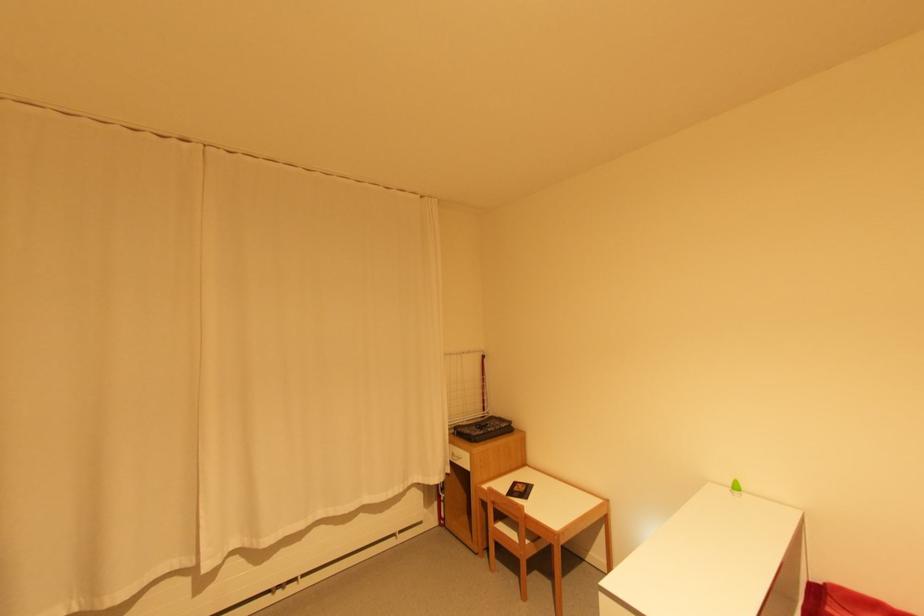
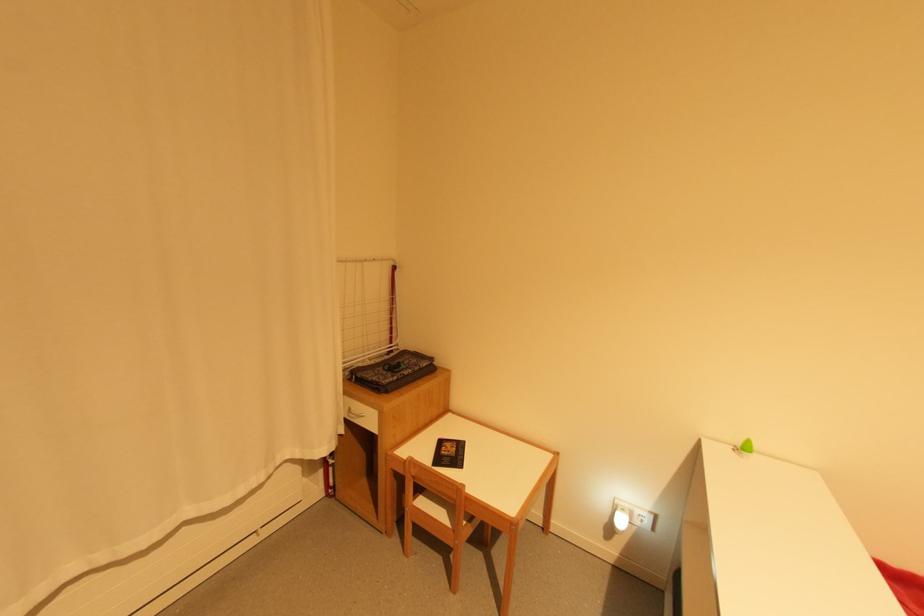
The point at (458, 455) is marked in the first image. Where is the corresponding point in the second image?

(357, 411)